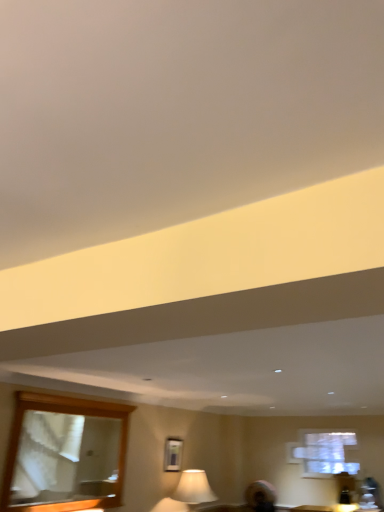
Question: Would you say metallic silver picture frame at center is a long distance from wooden-framed mirror at lower left?

Choices:
 (A) yes
 (B) no

Answer: (A)

Question: From a real-world perspective, is metallic silver picture frame at center below wooden-framed mirror at lower left?

Choices:
 (A) yes
 (B) no

Answer: (A)

Question: Is wooden-framed mirror at lower left located within metallic silver picture frame at center?

Choices:
 (A) no
 (B) yes

Answer: (A)

Question: Is metallic silver picture frame at center facing away from wooden-framed mirror at lower left?

Choices:
 (A) yes
 (B) no

Answer: (B)

Question: From the image's perspective, is metallic silver picture frame at center above wooden-framed mirror at lower left?

Choices:
 (A) no
 (B) yes

Answer: (A)

Question: From a real-world perspective, is metallic silver picture frame at center on wooden-framed mirror at lower left?

Choices:
 (A) no
 (B) yes

Answer: (A)

Question: From the image's perspective, is wooden-framed mirror at lower left on metallic silver picture frame at center?

Choices:
 (A) no
 (B) yes

Answer: (B)

Question: From the image's perspective, does wooden-framed mirror at lower left appear lower than metallic silver picture frame at center?

Choices:
 (A) no
 (B) yes

Answer: (A)

Question: Can you confirm if wooden-framed mirror at lower left is bigger than metallic silver picture frame at center?

Choices:
 (A) no
 (B) yes

Answer: (B)

Question: Considering the relative sizes of wooden-framed mirror at lower left and metallic silver picture frame at center in the image provided, is wooden-framed mirror at lower left taller than metallic silver picture frame at center?

Choices:
 (A) yes
 (B) no

Answer: (A)

Question: Can you confirm if wooden-framed mirror at lower left is thinner than metallic silver picture frame at center?

Choices:
 (A) no
 (B) yes

Answer: (A)

Question: Does wooden-framed mirror at lower left lie behind metallic silver picture frame at center?

Choices:
 (A) no
 (B) yes

Answer: (A)

Question: In the image, is wooden-framed mirror at lower left on the left side or the right side of metallic silver picture frame at center?

Choices:
 (A) left
 (B) right

Answer: (A)